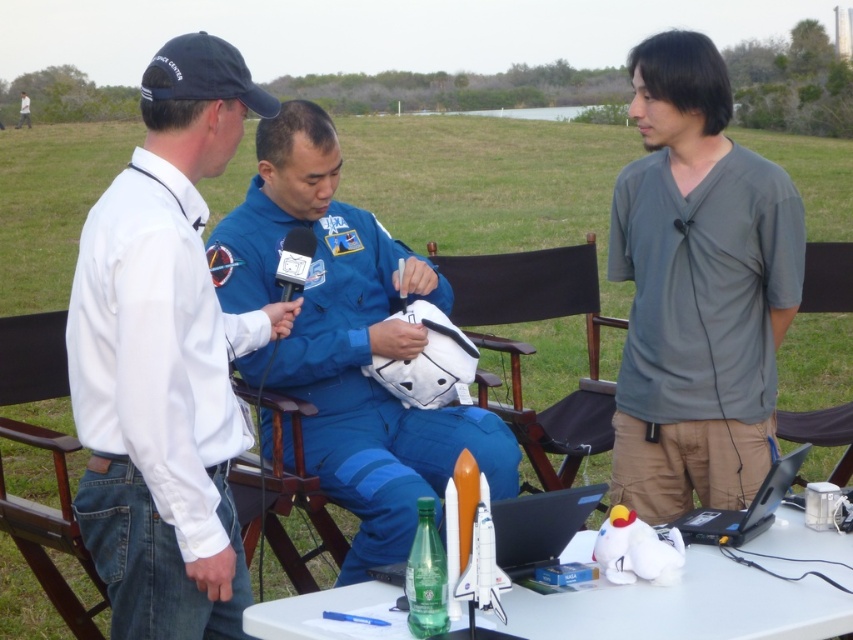
Does point (57, 481) lie in front of point (780, 490)?

No, it is not.

Between brown wood chair at left and black plastic laptop at lower right, which one has less height?

black plastic laptop at lower right

Is point (103, 596) positioned before point (770, 483)?

That is False.

Where is `brown wood chair at left`? brown wood chair at left is located at coordinates (49, 529).

Can you confirm if gray cotton shirt at center is positioned to the left of blue fabric astronaut suit at center?

In fact, gray cotton shirt at center is to the right of blue fabric astronaut suit at center.

What do you see at coordinates (697, 289) in the screenshot? The width and height of the screenshot is (853, 640). I see `gray cotton shirt at center` at bounding box center [697, 289].

The height and width of the screenshot is (640, 853). Find the location of `gray cotton shirt at center`. gray cotton shirt at center is located at coordinates (697, 289).

Can you confirm if blue fabric astronaut suit at center is positioned below black plastic laptop at lower center?

No, blue fabric astronaut suit at center is not below black plastic laptop at lower center.

The height and width of the screenshot is (640, 853). What are the coordinates of `blue fabric astronaut suit at center` in the screenshot? It's located at (349, 340).